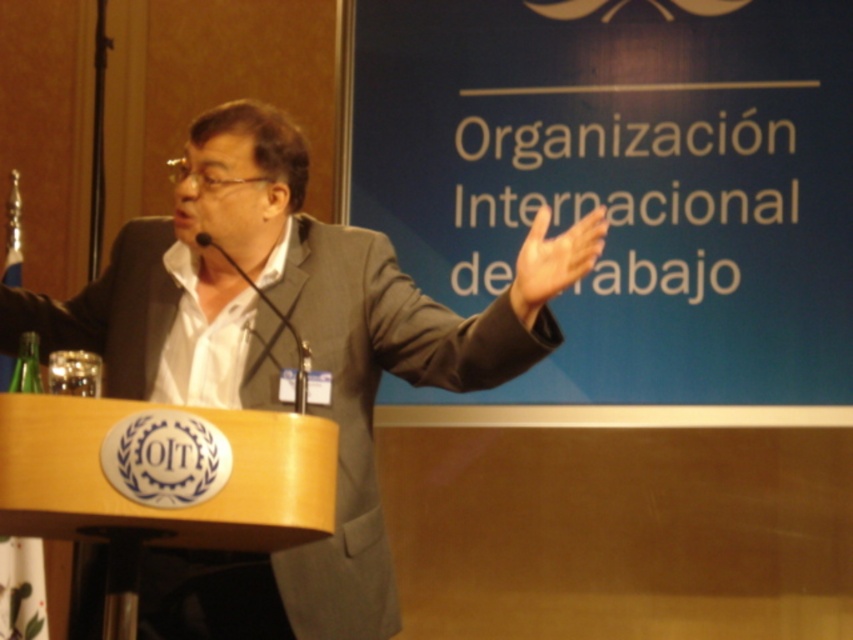
Question: Is gray suit at center positioned behind wooden podium at center?

Choices:
 (A) no
 (B) yes

Answer: (B)

Question: Does gray suit at center appear on the right side of white matte hand at upper center?

Choices:
 (A) no
 (B) yes

Answer: (A)

Question: Which point is closer to the camera?

Choices:
 (A) (112, 508)
 (B) (260, 593)
 (C) (583, 237)

Answer: (A)

Question: From the image, what is the correct spatial relationship of gray suit at center in relation to wooden podium at center?

Choices:
 (A) below
 (B) above

Answer: (B)

Question: Which point is farther to the camera?

Choices:
 (A) white matte hand at upper center
 (B) wooden podium at center
 (C) gray suit at center

Answer: (C)

Question: Which of the following is the closest to the observer?

Choices:
 (A) wooden podium at center
 (B) gray suit at center
 (C) white matte hand at upper center

Answer: (A)